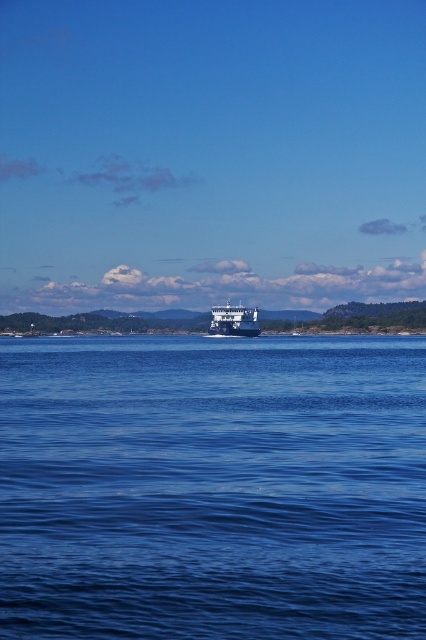
Based on the photo, you are standing on the ferry boat in the middle ground and want to know the position of the blue liquid water at center. Where exactly is it located?

The blue liquid water at center is located at point (213,486) according to the coordinate system.

You are a passenger on the blue metallic cruise ship at center and want to look at the blue liquid water at center. In which direction should you look from your position on the ship?

You should look to the right from your position on the blue metallic cruise ship at center to see the blue liquid water at center, since the blue liquid water at center is located to the right of the blue metallic cruise ship at center.